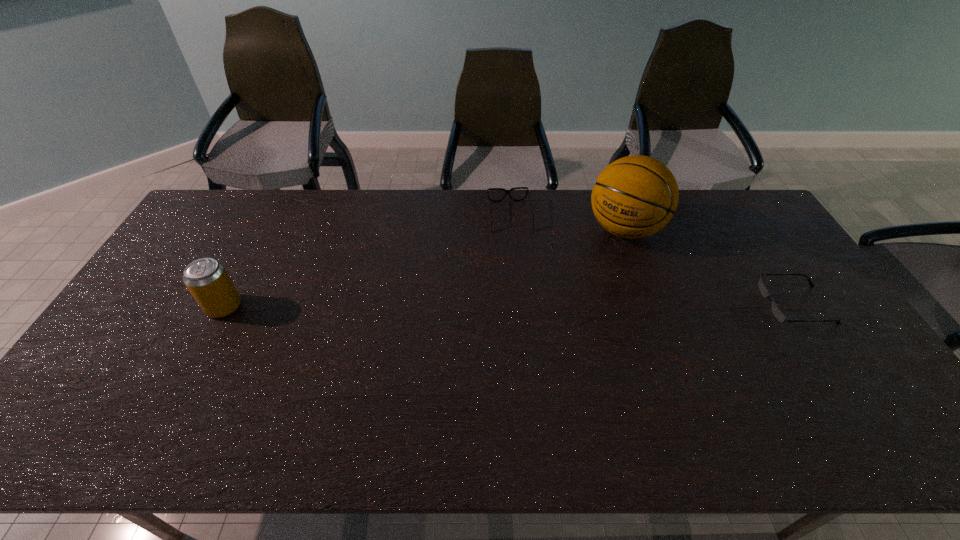
Identify the location of vacant space on the desktop that is between the pop (soda) and the shorter spectacles and is positioned with the lenses facing outward on the third object from right to left. (525, 306).

Identify the location of free space on the desktop that is between the leftmost object and the shortest object and is positioned on the surface of the basketball near the brand logo. (563, 306).